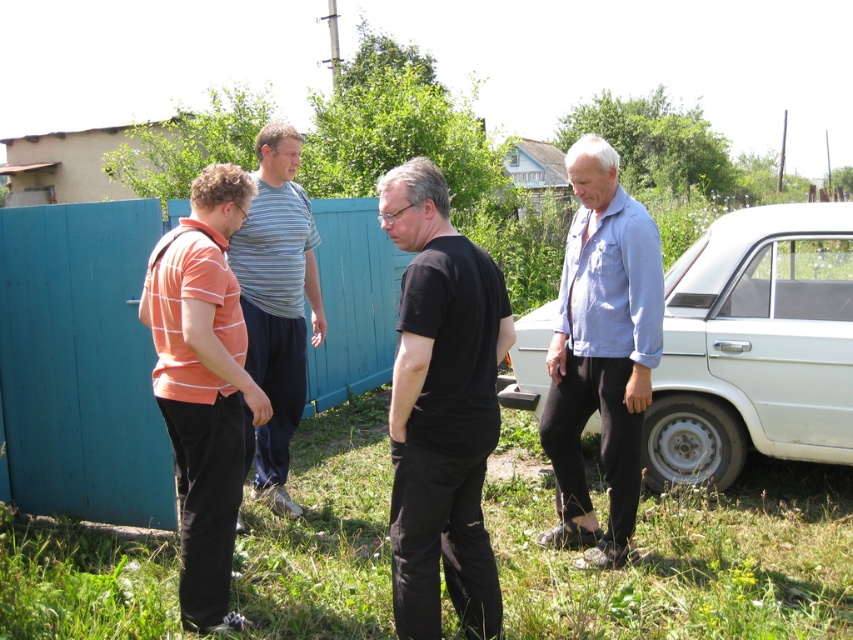
You are trying to decide whether to park your white matte car at right behind the striped cotton shirt at center. Based on their heights, will the car be visible from above the shirt?

The white matte car at right is not as tall as striped cotton shirt at center, so the car will not be visible from above the shirt because it is shorter.

You are standing at the camera position and want to reach the point marked at coordinates (x=640, y=522). Can you walk directly to it without crossing any obstacles?

The point marked at coordinates (x=640, y=522) is 4.34 meters away from the camera. Since the scene description mentions a grassy area with patches of greenery and some weeds, but no specific obstacles like fences or buildings blocking the path, it should be possible to walk directly to the point without crossing obstacles.

You are a delivery person trying to reach the striped cotton shirt at center, who is standing near a white matte car at right. According to the scene, is the car blocking your path to the shirt?

The white matte car at right is located above striped cotton shirt at center, so the car is not blocking the path since it is positioned higher up.